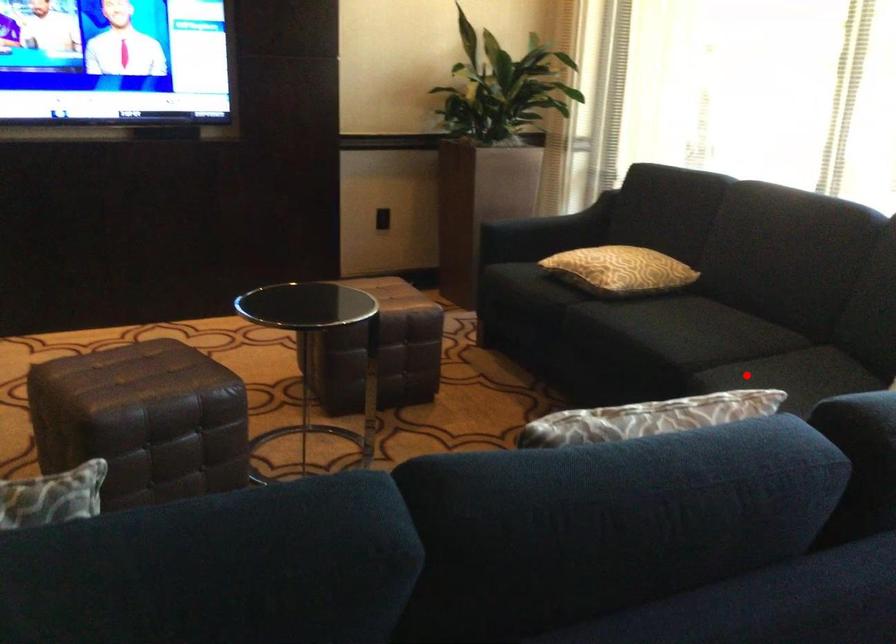
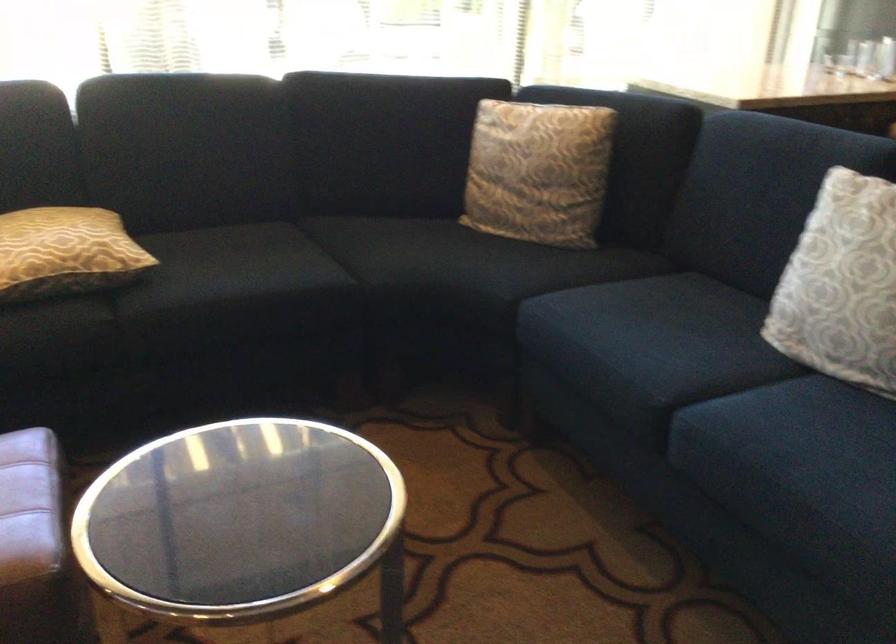
In the second image, find the point that corresponds to the highlighted location in the first image.

(391, 261)